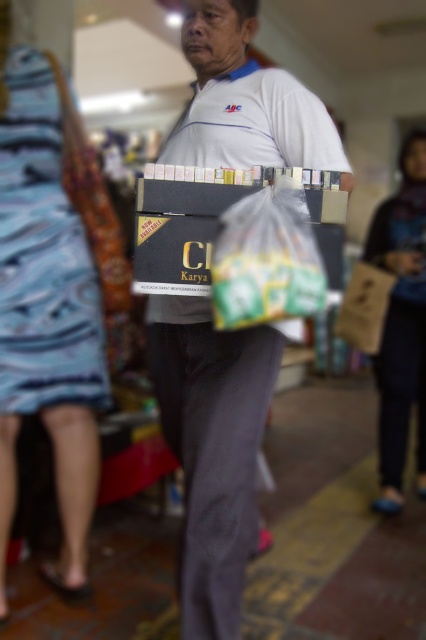
Between white matte box at center and blue fabric bag at lower right, which one appears on the right side from the viewer's perspective?

Positioned to the right is blue fabric bag at lower right.

Is white matte box at center positioned before blue fabric bag at lower right?

Yes, it is.

Is point (239, 449) closer to camera compared to point (379, 508)?

Yes, it is.

Where is `white matte box at center`? This screenshot has height=640, width=426. white matte box at center is located at coordinates (212, 448).

Can you confirm if white matte box at center is smaller than blue patterned dress at lower left?

Yes, white matte box at center is smaller than blue patterned dress at lower left.

Which is more to the left, white matte box at center or blue patterned dress at lower left?

From the viewer's perspective, blue patterned dress at lower left appears more on the left side.

Does point (307, 112) lie behind point (72, 588)?

No, (307, 112) is closer to viewer.

I want to click on white matte box at center, so click(x=212, y=448).

Which is above, blue patterned dress at lower left or blue fabric bag at lower right?

blue fabric bag at lower right is higher up.

Does blue patterned dress at lower left have a lesser height compared to blue fabric bag at lower right?

No, blue patterned dress at lower left is not shorter than blue fabric bag at lower right.

The width and height of the screenshot is (426, 640). Describe the element at coordinates (46, 316) in the screenshot. I see `blue patterned dress at lower left` at that location.

This screenshot has width=426, height=640. Find the location of `blue patterned dress at lower left`. blue patterned dress at lower left is located at coordinates (46, 316).